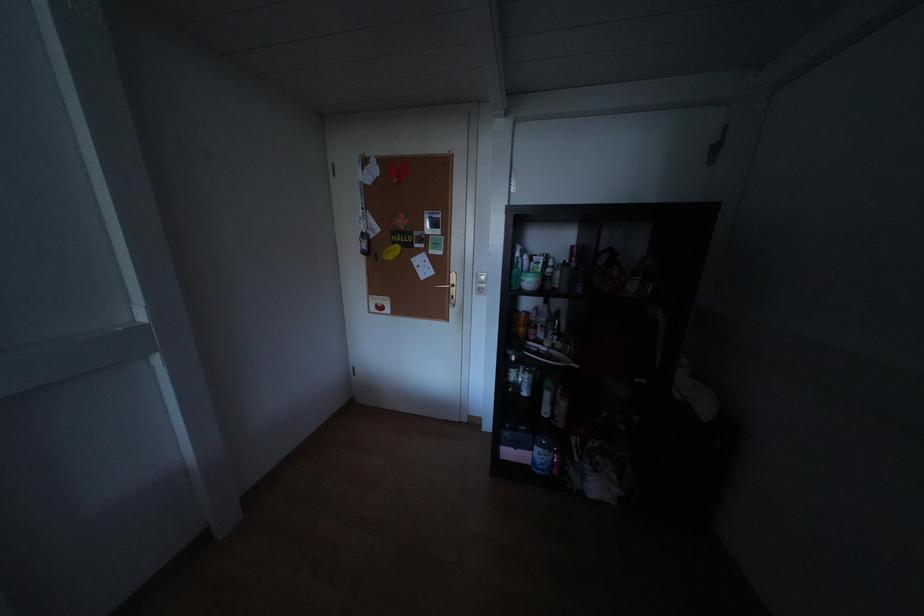
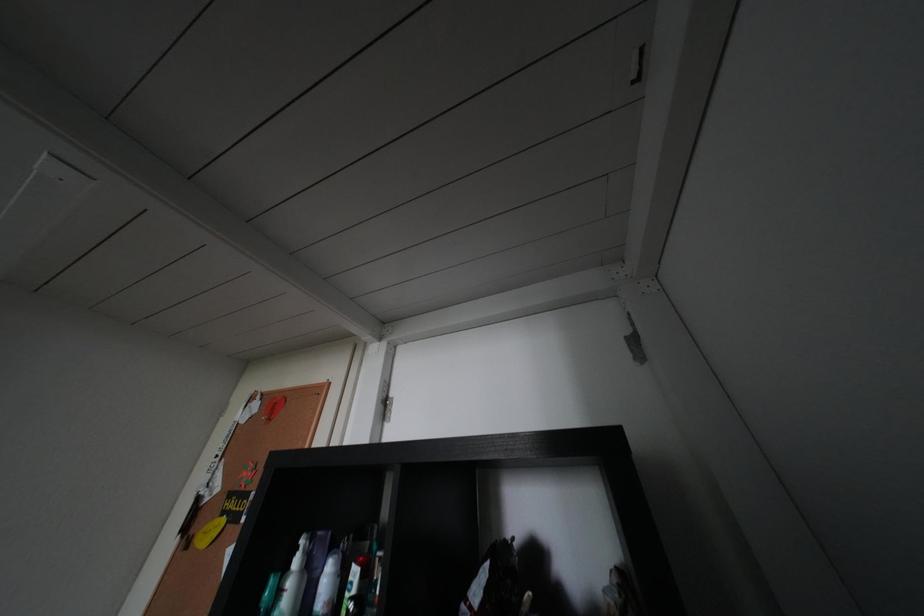
Question: The images are taken continuously from a first-person perspective. In which direction is your viewpoint rotating?

Choices:
 (A) Left
 (B) Right
 (C) Up
 (D) Down

Answer: (C)